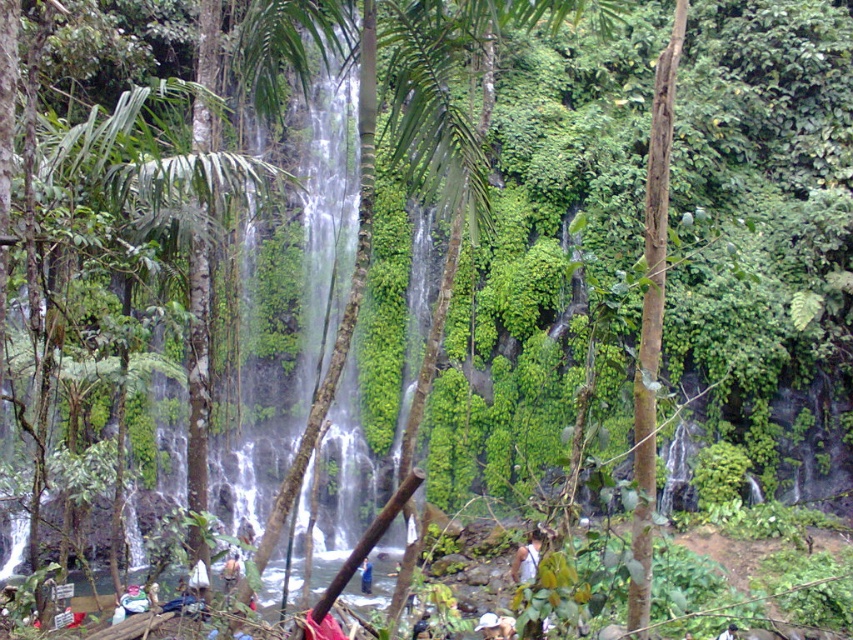
Can you confirm if white fabric at center is positioned to the right of dark blue fabric at lower right?

Answer: No, white fabric at center is not to the right of dark blue fabric at lower right.

Which is behind, point (515, 566) or point (735, 637)?

Point (515, 566)

Does point (524, 579) lie behind point (730, 632)?

That is True.

The image size is (853, 640). Find the location of `white fabric at center`. white fabric at center is located at coordinates (527, 557).

Which is above, white fabric at center or blue fabric at center?

white fabric at center

In order to click on white fabric at center in this screenshot , I will do `click(527, 557)`.

Is blue fabric at center taller than dark blue fabric at lower right?

Yes.

Which of these two, blue fabric at center or dark blue fabric at lower right, stands shorter?

dark blue fabric at lower right is shorter.

I want to click on blue fabric at center, so click(x=364, y=577).

The image size is (853, 640). Identify the location of blue fabric at center. (364, 577).